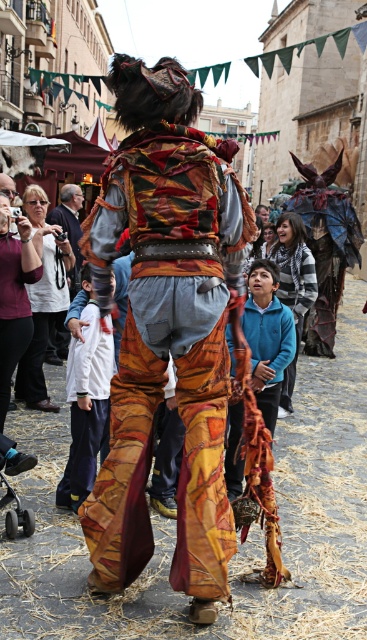
You are a photographer trying to capture the textured fabric costume at center and the matte black camera at left in a single frame. Which object should be placed closer to the camera to ensure both are fully visible in the photo?

The textured fabric costume at center is taller than the matte black camera at left, so to ensure both are fully visible in the photo, the matte black camera at left should be placed closer to the camera. This way, the height difference is minimized, allowing both objects to fit within the frame appropriately.

You are a photographer at the event and want to capture the textured fabric costume at center and the blue fleece sweater at center in a single shot. Which object should you focus on first to ensure both are in frame?

The textured fabric costume at center is positioned under the blue fleece sweater at center, so you should focus on the blue fleece sweater at center first to ensure both are in frame.

You are a photographer positioned at the camera location capturing this festive street scene. You want to ensure that the point at coordinates point (97, 509) is in focus. Considering your camera has a depth of field that can sharply capture objects within 50 feet, will this point be in focus?

The point at coordinates point (97, 509) is 47.23 feet away from the camera, which is within the 50 feet depth of field range. Therefore, the point will be in focus.